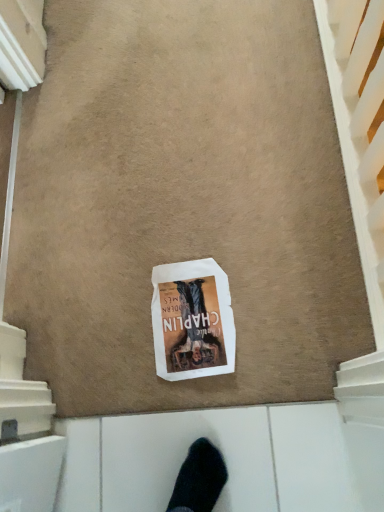
I want to click on vacant space underneath white paper bag at center (from a real-world perspective), so click(187, 315).